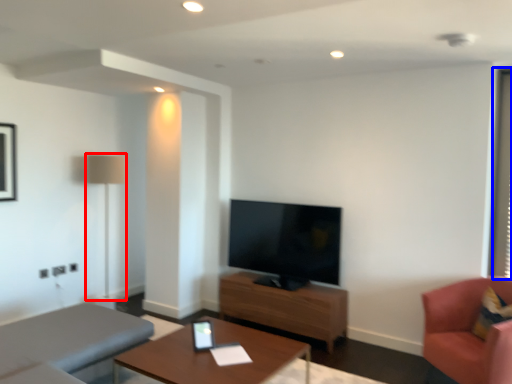
Question: Which object is closer to the camera taking this photo, lamp (highlighted by a red box) or window screen (highlighted by a blue box)?

Choices:
 (A) lamp
 (B) window screen

Answer: (B)